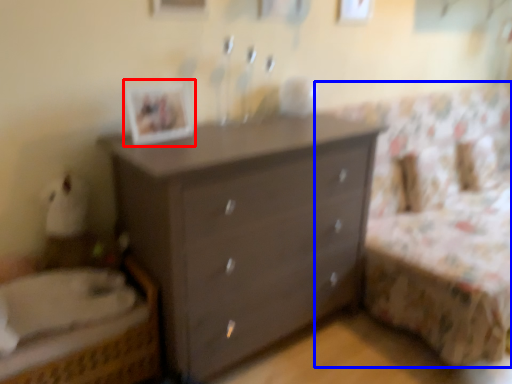
Question: Which of the following is the closest to the observer, picture frame (highlighted by a red box) or bed frame (highlighted by a blue box)?

Choices:
 (A) picture frame
 (B) bed frame

Answer: (B)